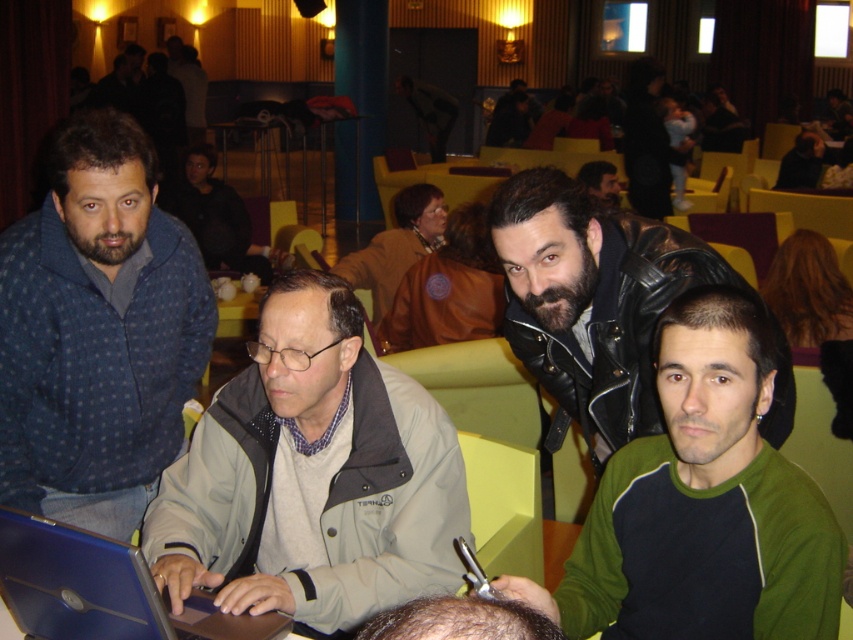
You are at a social gathering and want to take a photo of the blue dotted sweater at left without getting too close. The camera you have can focus clearly up to 5 feet. Will you be able to take a clear photo from your current position?

The blue dotted sweater at left and camera are 5.27 feet apart from each other. Since the camera can focus up to 5 feet, the distance is slightly beyond its range. Therefore, you won cannot take a clear photo from your current position.

You are a photographer at the event and want to capture both the green fleece at center and the leather jacket at center in a single frame. Since you can only focus on one subject at a time, which one should you choose to ensure the other remains in the background without being too blurry?

The green fleece at center is smaller than the leather jacket at center, so focusing on the larger leather jacket at center would allow the smaller green fleece at center to stay in the background with less blur.